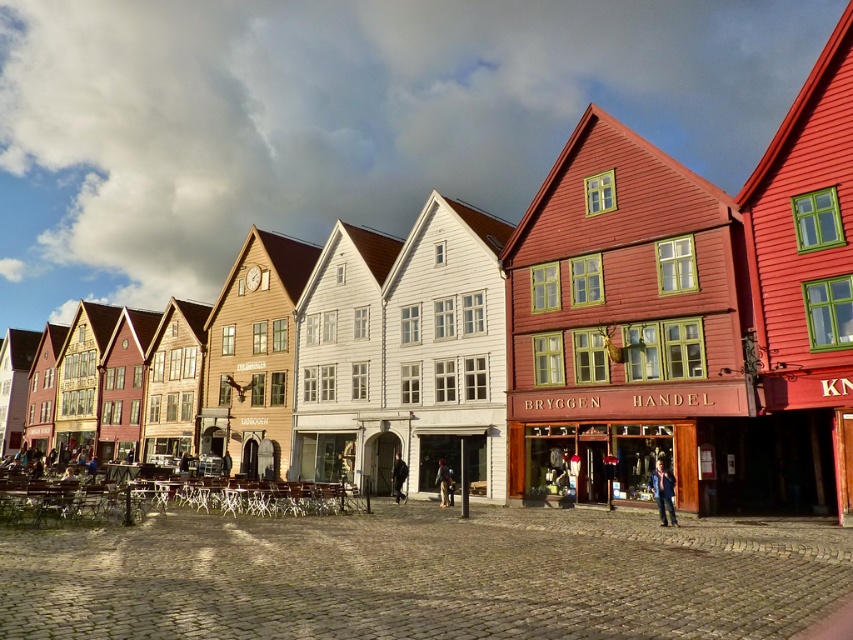
Which is in front, point (630, 448) or point (657, 496)?

Positioned in front is point (657, 496).

This screenshot has height=640, width=853. Identify the location of wooden shop at center. (605, 458).

Find the location of a particular element. blue denim jacket at lower right is located at coordinates (662, 492).

Can you confirm if blue denim jacket at lower right is positioned below black leather jacket at center?

No, blue denim jacket at lower right is not below black leather jacket at center.

Where is `blue denim jacket at lower right`? This screenshot has height=640, width=853. blue denim jacket at lower right is located at coordinates (662, 492).

Which is below, wooden shop at center or black leather jacket at center?

Positioned lower is black leather jacket at center.

Between point (529, 496) and point (407, 472), which one is positioned behind?

The point (407, 472) is more distant.

I want to click on wooden shop at center, so click(x=605, y=458).